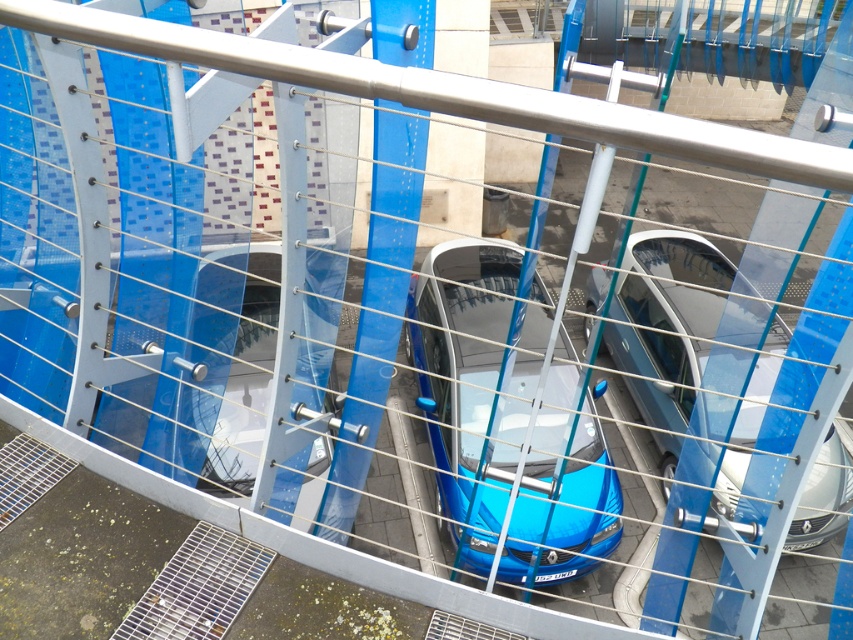
Question: Can you confirm if blue glossy car at center is positioned to the left of glossy blue car at center?

Choices:
 (A) yes
 (B) no

Answer: (A)

Question: From the image, what is the correct spatial relationship of blue glossy car at center in relation to glossy blue car at center?

Choices:
 (A) below
 (B) above

Answer: (A)

Question: Is blue glossy car at center positioned before glossy blue car at center?

Choices:
 (A) no
 (B) yes

Answer: (B)

Question: Which object is farther from the camera taking this photo?

Choices:
 (A) glossy blue car at center
 (B) blue glossy car at center

Answer: (A)